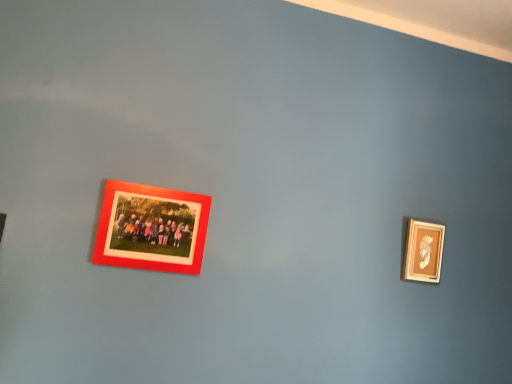
Question: Is matte red photo frame at upper left, positioned as the 1th picture frame in front-to-back order, wider or thinner than wooden gold frame at right, the 2th picture frame when ordered from left to right?

Choices:
 (A) thin
 (B) wide

Answer: (A)

Question: Is point (152, 251) closer or farther from the camera than point (413, 276)?

Choices:
 (A) closer
 (B) farther

Answer: (A)

Question: From a real-world perspective, is matte red photo frame at upper left, the second picture frame viewed from the back, positioned above or below wooden gold frame at right, which ranks as the second picture frame in front-to-back order?

Choices:
 (A) below
 (B) above

Answer: (A)

Question: From a real-world perspective, is wooden gold frame at right, which ranks as the second picture frame in front-to-back order, above or below matte red photo frame at upper left, marked as the 1th picture frame in a left-to-right arrangement?

Choices:
 (A) below
 (B) above

Answer: (B)

Question: In terms of size, does wooden gold frame at right, which ranks as the second picture frame in front-to-back order, appear bigger or smaller than matte red photo frame at upper left, the second picture frame viewed from the back?

Choices:
 (A) big
 (B) small

Answer: (B)

Question: Is point (432, 235) closer or farther from the camera than point (173, 218)?

Choices:
 (A) closer
 (B) farther

Answer: (B)

Question: Is wooden gold frame at right, which appears as the first picture frame when viewed from the back, inside or outside of matte red photo frame at upper left, marked as the 1th picture frame in a left-to-right arrangement?

Choices:
 (A) inside
 (B) outside

Answer: (B)